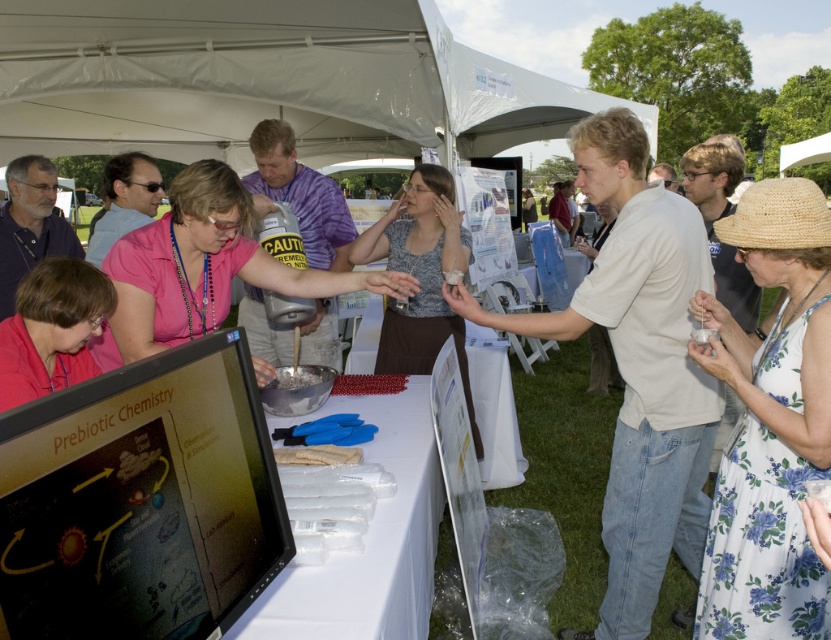
You are standing at the center of the image. Which direction should you move to reach the point at coordinates point [52,330]?

The point at coordinates point [52,330] is on the lower left, so you should move towards the lower left direction to reach it.

You are organizing a science fair booth and need to hang a poster that requires 1.5 meters of width. You have two shirts available for makeshift hanging space. Can the pink fabric shirt at center and the matte pink shirt at lower left combined provide enough width for the poster?

The pink fabric shirt at center has a larger width than the matte pink shirt at lower left. However, without knowing the exact widths of each shirt, we cannot determine if their combined width meets the 1.5 meters requirement. Please measure both shirts to confirm.